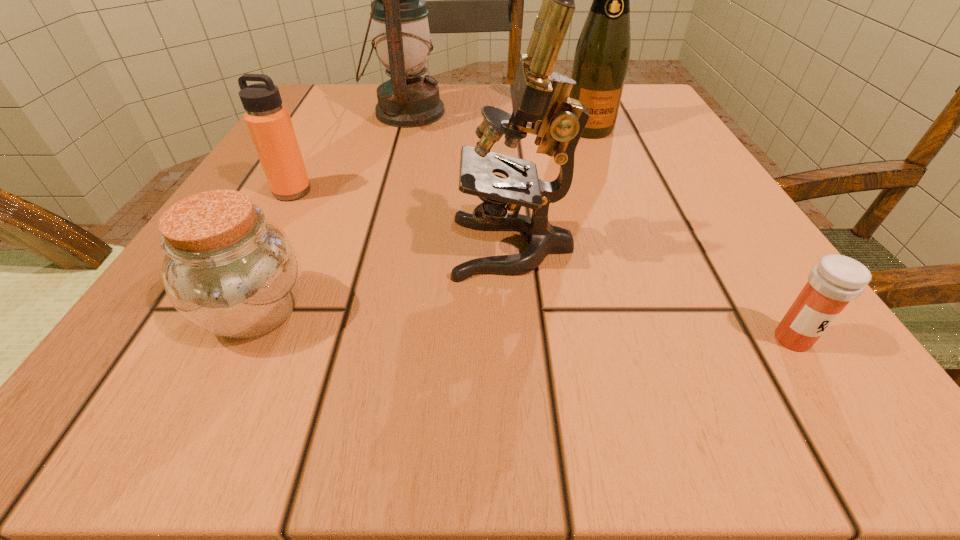
At what (x,y) coordinates should I click in order to perform the action: click on wine bottle. Please return your answer as a coordinate pair (x, y). The image size is (960, 540). Looking at the image, I should click on (601, 58).

Identify the location of oil lamp. [x=402, y=40].

Locate an element on the screen. The image size is (960, 540). microscope is located at coordinates click(541, 104).

Where is `the third shortest object`? The image size is (960, 540). the third shortest object is located at coordinates (268, 121).

The width and height of the screenshot is (960, 540). In order to click on thermos bottle in this screenshot , I will do `click(268, 121)`.

Locate an element on the screen. This screenshot has height=540, width=960. the second shortest object is located at coordinates (228, 270).

Find the location of `medicine`. medicine is located at coordinates (836, 280).

The height and width of the screenshot is (540, 960). Identify the location of the rightmost object. (836, 280).

You are a GUI agent. You are given a task and a screenshot of the screen. Output one action in this format:
    pyautogui.click(x=<x>, y=<y>)
    Task: Click on the free space located on the front-facing side of the wine bottle
    
    Given the screenshot: What is the action you would take?
    pyautogui.click(x=628, y=228)

Where is `free space located on the front of the oil lamp`? The height and width of the screenshot is (540, 960). free space located on the front of the oil lamp is located at coordinates tap(368, 251).